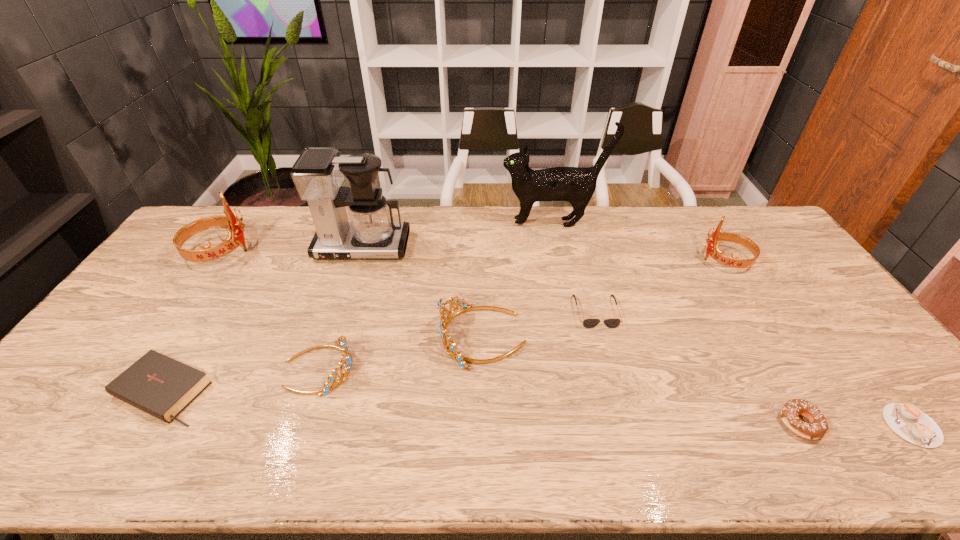
Where is `the left gold tiara`? the left gold tiara is located at coordinates (346, 363).

Identify the location of black sunglasses. [590, 322].

This screenshot has width=960, height=540. I want to click on chocolate doughnut, so click(x=818, y=426).

I want to click on Bible, so click(163, 387).

You are a GUI agent. You are given a task and a screenshot of the screen. Output one action in this format:
    pyautogui.click(x=<x>, y=<y>)
    Task: Click on the cappuccino
    The width and height of the screenshot is (960, 540).
    Given the screenshot: What is the action you would take?
    pyautogui.click(x=906, y=420)

The height and width of the screenshot is (540, 960). I want to click on white cappuccino, so click(x=906, y=420).

Where is `vacant region located 0.260m on the face of the farthest object`? The width and height of the screenshot is (960, 540). vacant region located 0.260m on the face of the farthest object is located at coordinates (431, 223).

The width and height of the screenshot is (960, 540). I want to click on vacant point located on the face of the farthest object, so click(x=434, y=223).

The image size is (960, 540). Find the location of `vacant space situated on the face of the farthest object`. vacant space situated on the face of the farthest object is located at coordinates (420, 223).

I want to click on vacant space located 0.200m at the front of the coffee maker where the controls are located, so click(343, 308).